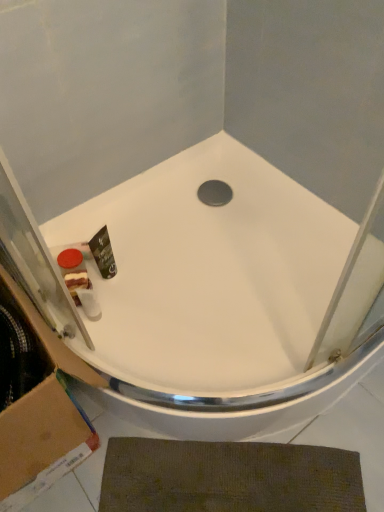
What are the coordinates of `vacant region below brown textured bath mat at lower center (from a real-world perspective)` in the screenshot? It's located at (273, 485).